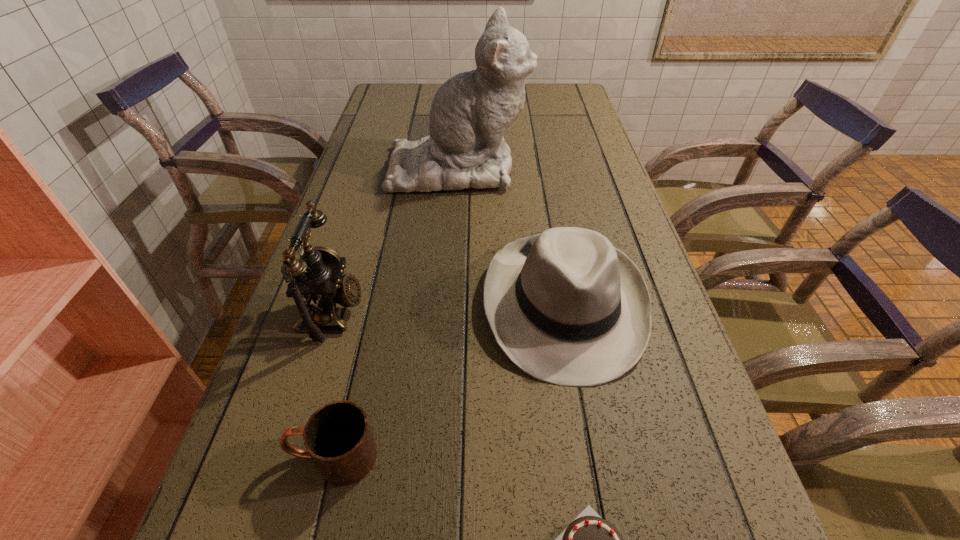
You are a GUI agent. You are given a task and a screenshot of the screen. Output one action in this format:
    pyautogui.click(x=<x>, y=<y>)
    Task: Click on the vacant region between the third tallest object and the second shortest object
    This screenshot has width=960, height=540.
    Given the screenshot: What is the action you would take?
    pyautogui.click(x=448, y=380)

At what (x,y) coordinates should I click in order to perform the action: click on empty space that is in between the fedora and the tallest object. Please return your answer as a coordinate pair (x, y). The height and width of the screenshot is (540, 960). Looking at the image, I should click on 511,235.

Locate an element on the screen. The height and width of the screenshot is (540, 960). free space between the fedora and the fourth farthest object is located at coordinates (448, 380).

At what (x,y) coordinates should I click in order to perform the action: click on object that is the closest one to the third tallest object. Please return your answer as a coordinate pair (x, y). Image resolution: width=960 pixels, height=540 pixels. Looking at the image, I should click on (338, 438).

Where is `the closest object to the fedora`? The width and height of the screenshot is (960, 540). the closest object to the fedora is located at coordinates (338, 438).

Find the location of a particular element. vacant region that satisfies the following two spatial constraints: 1. on the front-facing side of the fedora; 2. on the side of the second shortest object with the handle is located at coordinates (591, 456).

Find the location of a particular element. The image size is (960, 540). free space that satisfies the following two spatial constraints: 1. on the front-facing side of the fedora; 2. on the side of the mug with the handle is located at coordinates (591, 456).

Locate an element on the screen. vacant space that satisfies the following two spatial constraints: 1. on the front-facing side of the fedora; 2. on the rotary dial of the fourth shortest object is located at coordinates (565, 312).

You are a GUI agent. You are given a task and a screenshot of the screen. Output one action in this format:
    pyautogui.click(x=<x>, y=<y>)
    Task: Click on the blank area in the image that satisfies the following two spatial constraints: 1. on the front-facing side of the fedora; 2. on the side of the second shortest object with the handle
    
    Given the screenshot: What is the action you would take?
    pyautogui.click(x=591, y=456)